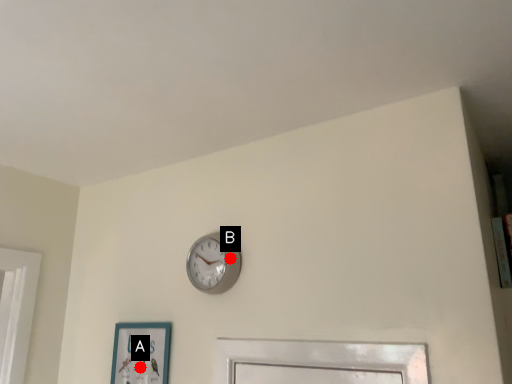
Question: Two points are circled on the image, labeled by A and B beside each circle. Which point is farther to the camera?

Choices:
 (A) A is further
 (B) B is further

Answer: (A)